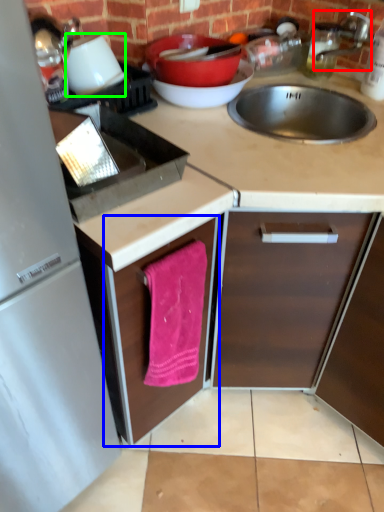
Question: Estimate the real-world distances between objects in this image. Which object is closer to faucet (highlighted by a red box), cabinetry (highlighted by a blue box) or appliance (highlighted by a green box)?

Choices:
 (A) cabinetry
 (B) appliance

Answer: (B)